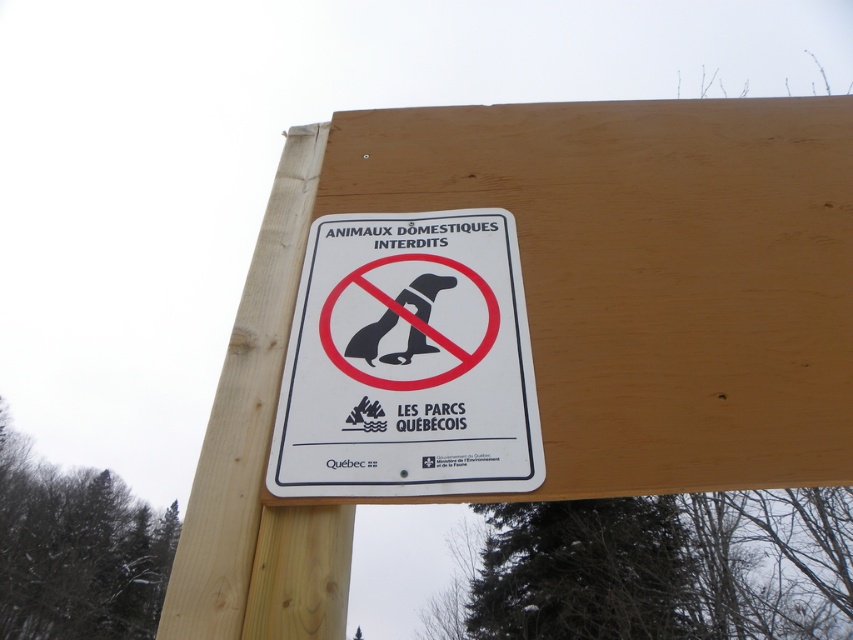
You are a hiker trying to read a sign at a Quebec park. You notice the white plastic sign at center and the wooden post at center. Which object is narrower?

The white plastic sign at center is narrower than the wooden post at center because it has a lesser width compared to the wooden post at center.

You are a hiker approaching a wooden post at center with a white plastic sign at center attached to it. Which object will you encounter first as you walk towards them?

The white plastic sign at center is closer to you than the wooden post at center, so you will encounter the white plastic sign at center first.